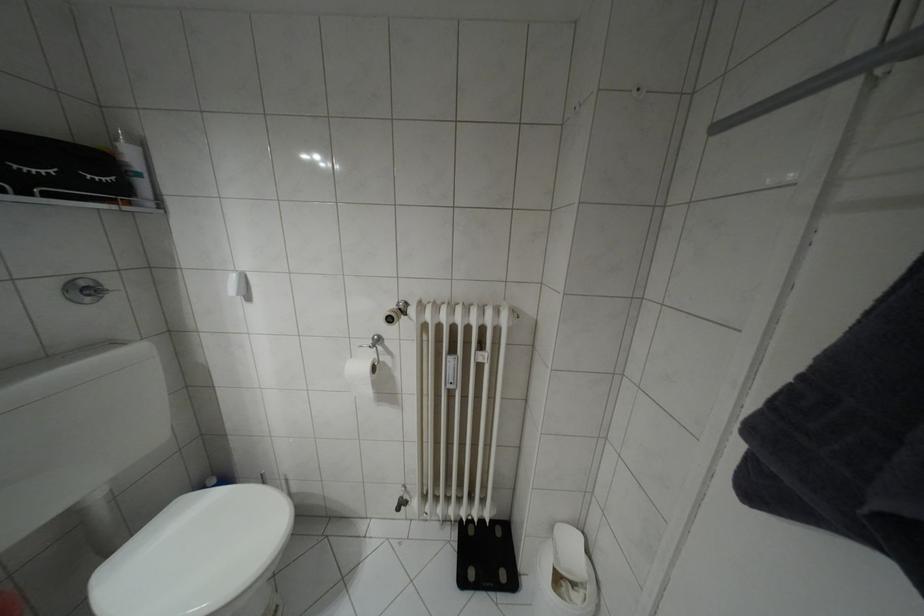
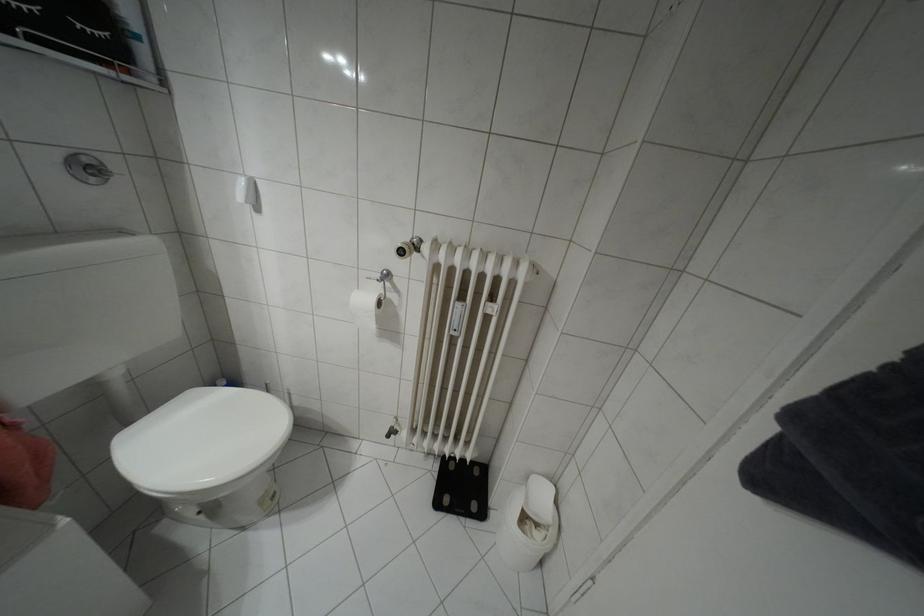
Question: Which direction would the cameraman need to move to produce the second image? Reply with the corresponding letter.

Choices:
 (A) Left
 (B) Right
 (C) Forward
 (D) Backward

Answer: (C)